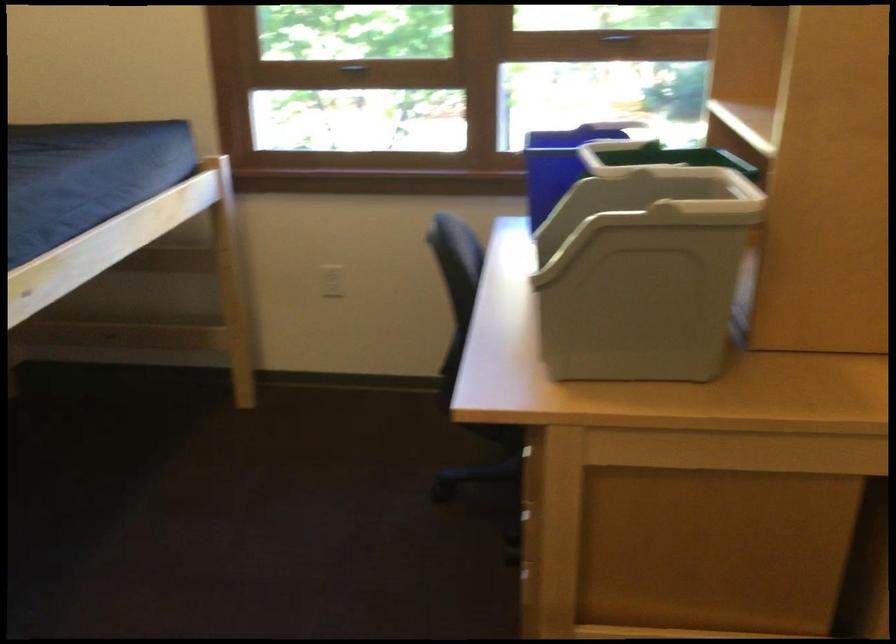
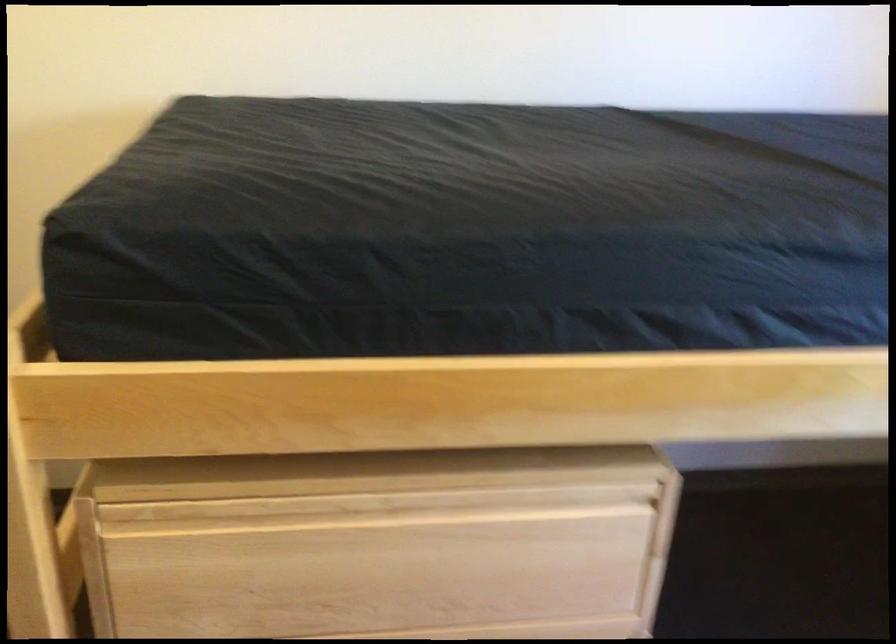
First-person continuous shooting, in which direction is the camera rotating?

The camera rotated toward left-down.